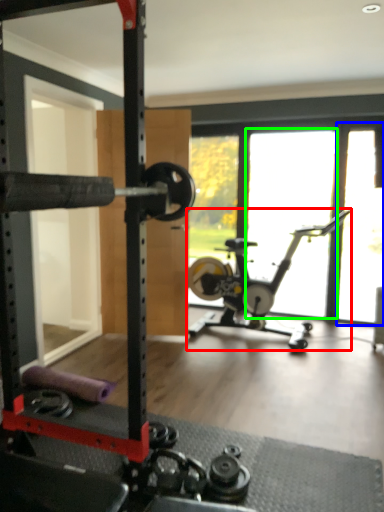
Question: Estimate the real-world distances between objects in this image. Which object is closer to stationary bicycle (highlighted by a red box), window screen (highlighted by a blue box) or window (highlighted by a green box)?

Choices:
 (A) window screen
 (B) window

Answer: (A)